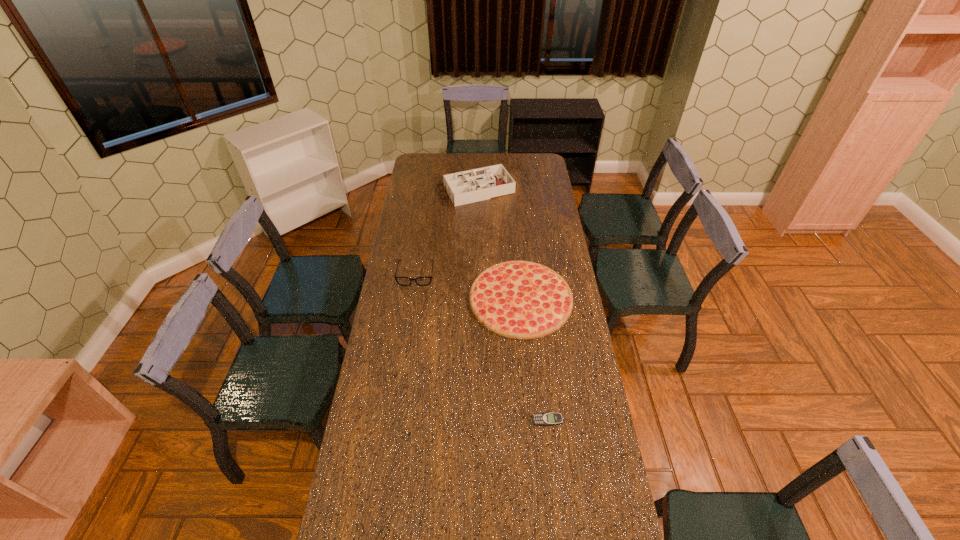
Image resolution: width=960 pixels, height=540 pixels. In order to click on the tallest object in this screenshot , I will do click(465, 187).

Identify the location of the farthest object. This screenshot has width=960, height=540. (465, 187).

Where is `the second tallest object`? The height and width of the screenshot is (540, 960). the second tallest object is located at coordinates (403, 281).

Find the location of a particular element. The width and height of the screenshot is (960, 540). pizza is located at coordinates (519, 299).

The width and height of the screenshot is (960, 540). I want to click on the nearest object, so click(541, 419).

Where is `the shortest object`? This screenshot has height=540, width=960. the shortest object is located at coordinates [x=541, y=419].

The image size is (960, 540). What are the coordinates of `vacant space situated 0.050m on the left of the farthest object` in the screenshot? It's located at (428, 191).

At what (x,y) coordinates should I click in order to perform the action: click on free spot located 0.140m on the front-facing side of the spectacles. Please return your answer as a coordinate pair (x, y). Looking at the image, I should click on (411, 310).

I want to click on free location located on the back of the pizza, so click(516, 247).

The height and width of the screenshot is (540, 960). In order to click on free space located 0.050m on the front of the nearest object in this screenshot , I will do `click(549, 440)`.